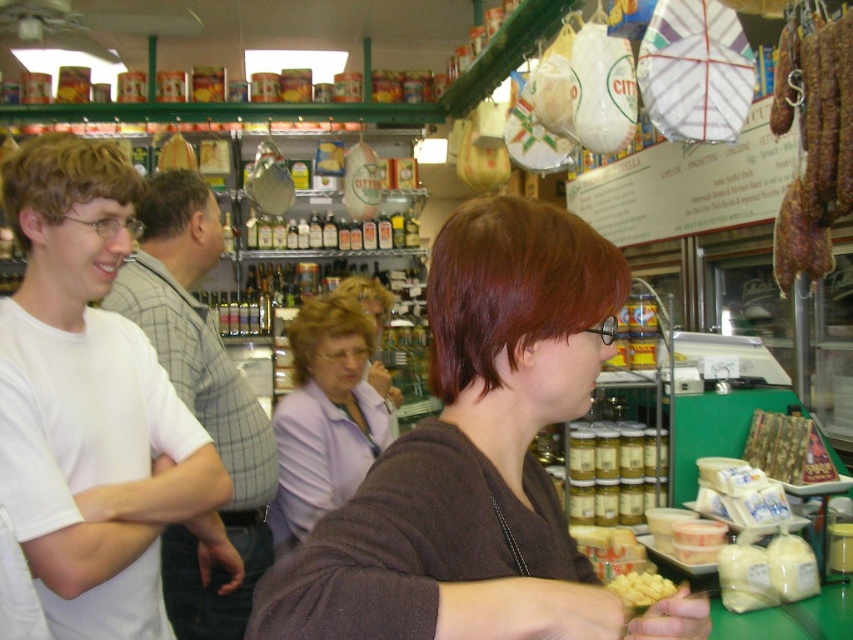
Can you confirm if brown matte shirt at center is smaller than brown leather sausage at right?

Actually, brown matte shirt at center might be larger than brown leather sausage at right.

Who is lower down, brown matte shirt at center or brown leather sausage at right?

brown matte shirt at center is below.

What do you see at coordinates (479, 460) in the screenshot? Image resolution: width=853 pixels, height=640 pixels. I see `brown matte shirt at center` at bounding box center [479, 460].

The height and width of the screenshot is (640, 853). In order to click on brown matte shirt at center in this screenshot , I will do `click(479, 460)`.

Is white t-shirt at left positioned behind brown leather sausage at right?

No.

Does point (67, 182) lie behind point (780, 86)?

No, it is not.

Where is `white t-shirt at left`? Image resolution: width=853 pixels, height=640 pixels. white t-shirt at left is located at coordinates (91, 404).

Does white t-shirt at left come in front of yellow cheese at center?

Yes, it is.

What do you see at coordinates (91, 404) in the screenshot? The height and width of the screenshot is (640, 853). I see `white t-shirt at left` at bounding box center [91, 404].

Does point (36, 285) come behind point (634, 579)?

No, it is not.

Identify the location of white t-shirt at left. This screenshot has width=853, height=640. (91, 404).